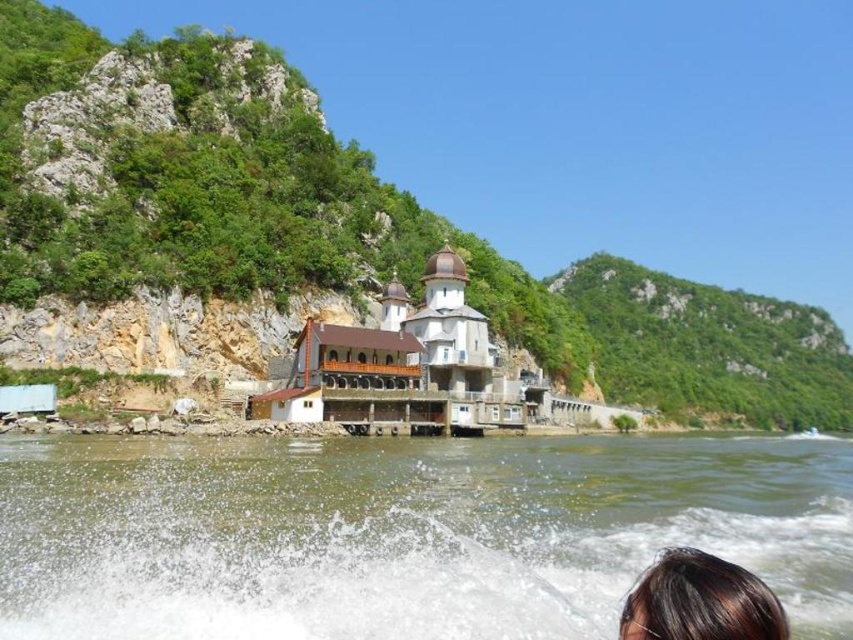
You are a swimmer trying to cross the river. You see the brown murky water at lower center and the brown hair at lower right. Which area would you avoid stepping into to prevent getting tangled?

You should avoid the brown hair at lower right because it is narrower and more likely to get tangled compared to the brown murky water at lower center.

You are navigating a boat on the river and see two points marked on your map. The first point is at coordinates point (465, 620) and the second is at point (668, 621). According to the image, which point is closer to the boat?

Point (668, 621) is closer to the boat because point (465, 620) is behind it.

You are a photographer taking a picture of the scene from the boat. You notice the brown murky water at lower center and the brown hair at lower right. Which object in the scene occupies a bigger area in the photo?

The brown murky water at lower center is larger in size than the brown hair at lower right, so it occupies a bigger area in the photo.